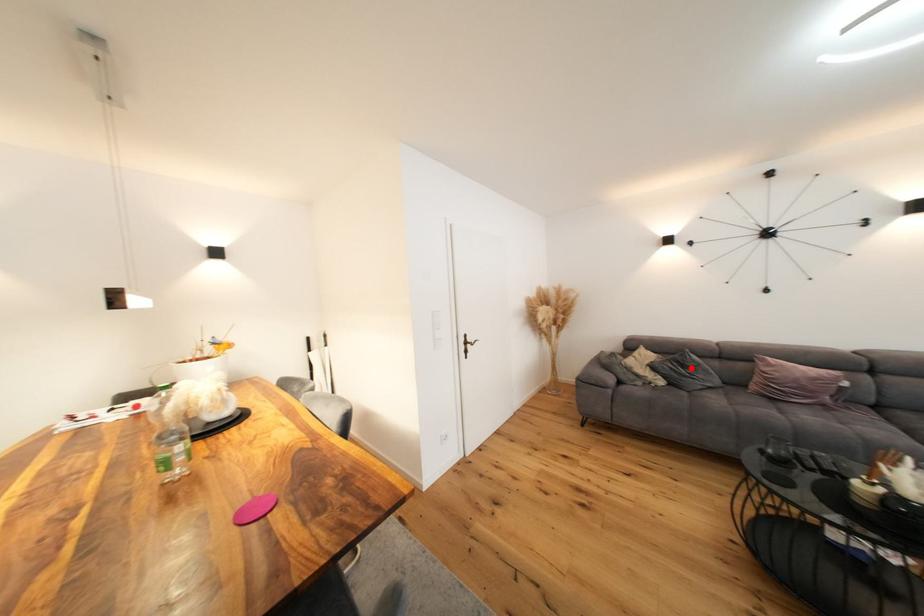
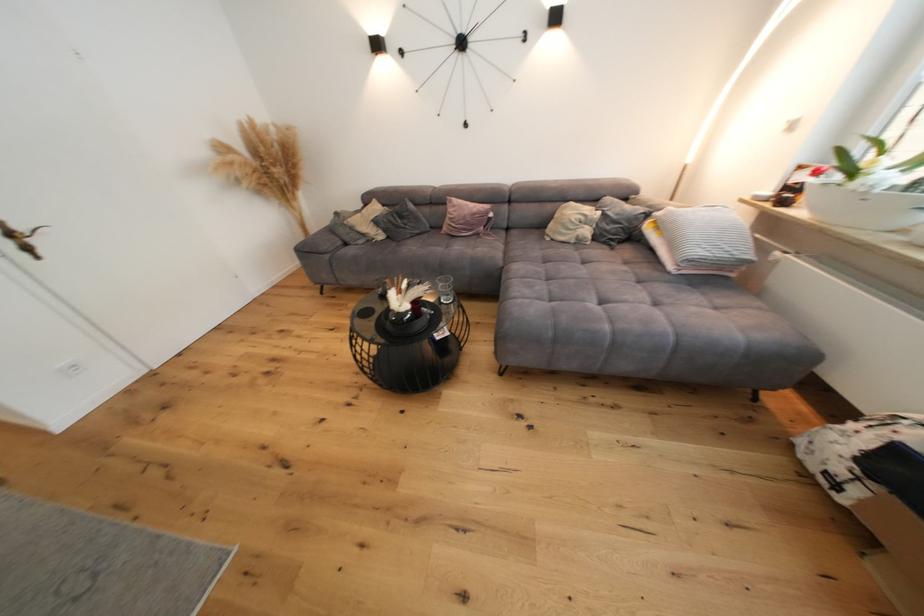
Find the pixel in the second image that matches the highlighted location in the first image.

(408, 219)